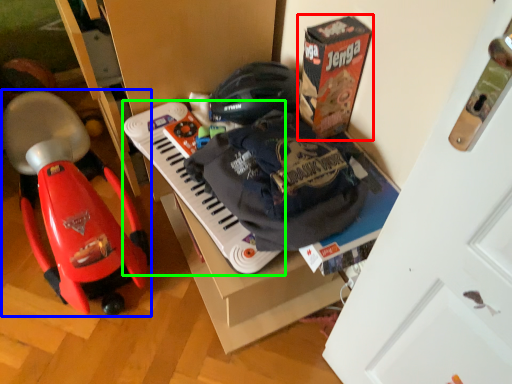
Question: Which object is positioned closest to box (highlighted by a red box)? Select from baby carriage (highlighted by a blue box) and musical keyboard (highlighted by a green box).

Choices:
 (A) baby carriage
 (B) musical keyboard

Answer: (B)